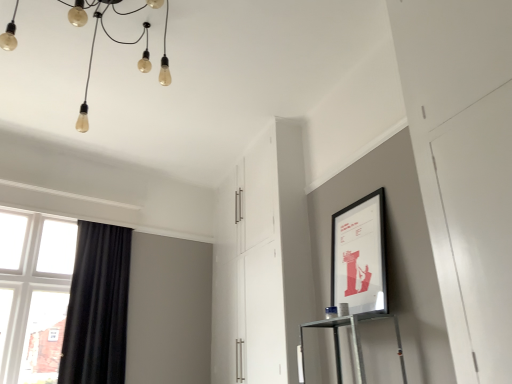
Question: From a real-world perspective, is matte black picture frame at upper right located beneath clear glass window at left?

Choices:
 (A) no
 (B) yes

Answer: (B)

Question: Is matte black picture frame at upper right oriented towards clear glass window at left?

Choices:
 (A) yes
 (B) no

Answer: (B)

Question: Can you confirm if matte black picture frame at upper right is bigger than clear glass window at left?

Choices:
 (A) no
 (B) yes

Answer: (A)

Question: Is matte black picture frame at upper right in contact with clear glass window at left?

Choices:
 (A) yes
 (B) no

Answer: (B)

Question: From the image's perspective, is matte black picture frame at upper right below clear glass window at left?

Choices:
 (A) no
 (B) yes

Answer: (A)

Question: Would you say matte black picture frame at upper right is inside or outside translucent glass lightbulbs at upper left?

Choices:
 (A) outside
 (B) inside

Answer: (A)

Question: In the image, is matte black picture frame at upper right on the left side or the right side of translucent glass lightbulbs at upper left?

Choices:
 (A) right
 (B) left

Answer: (A)

Question: From the image's perspective, relative to translucent glass lightbulbs at upper left, is matte black picture frame at upper right above or below?

Choices:
 (A) below
 (B) above

Answer: (A)

Question: Considering the positions of matte black picture frame at upper right and translucent glass lightbulbs at upper left in the image, is matte black picture frame at upper right wider or thinner than translucent glass lightbulbs at upper left?

Choices:
 (A) wide
 (B) thin

Answer: (B)

Question: Is black velvet curtain at left taller or shorter than translucent glass lightbulbs at upper left?

Choices:
 (A) short
 (B) tall

Answer: (B)

Question: From the image's perspective, relative to translucent glass lightbulbs at upper left, is black velvet curtain at left above or below?

Choices:
 (A) above
 (B) below

Answer: (B)

Question: Looking at the image, does black velvet curtain at left seem bigger or smaller compared to translucent glass lightbulbs at upper left?

Choices:
 (A) big
 (B) small

Answer: (B)

Question: Which is correct: black velvet curtain at left is inside translucent glass lightbulbs at upper left, or outside of it?

Choices:
 (A) outside
 (B) inside

Answer: (A)

Question: Considering the positions of white glossy cabinet at center and clear glass window at left in the image, is white glossy cabinet at center taller or shorter than clear glass window at left?

Choices:
 (A) short
 (B) tall

Answer: (B)

Question: Is point pyautogui.click(x=260, y=200) positioned closer to the camera than point pyautogui.click(x=11, y=344)?

Choices:
 (A) closer
 (B) farther

Answer: (B)